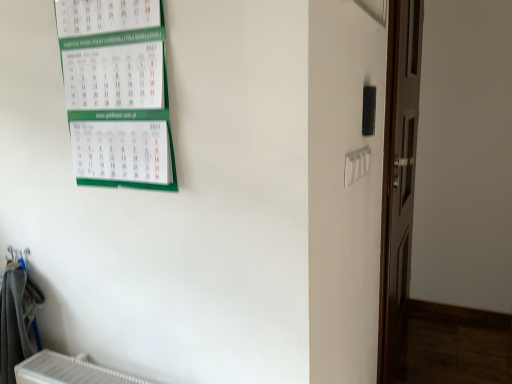
Question: Does green paper calendar at upper left have a greater height compared to brown wooden door at right?

Choices:
 (A) no
 (B) yes

Answer: (A)

Question: Considering the relative positions of green paper calendar at upper left and brown wooden door at right in the image provided, is green paper calendar at upper left in front of brown wooden door at right?

Choices:
 (A) no
 (B) yes

Answer: (B)

Question: From a real-world perspective, does green paper calendar at upper left sit lower than brown wooden door at right?

Choices:
 (A) yes
 (B) no

Answer: (B)

Question: Considering the relative sizes of green paper calendar at upper left and brown wooden door at right in the image provided, is green paper calendar at upper left wider than brown wooden door at right?

Choices:
 (A) yes
 (B) no

Answer: (B)

Question: Can you confirm if green paper calendar at upper left is smaller than brown wooden door at right?

Choices:
 (A) no
 (B) yes

Answer: (B)

Question: Is point (27, 274) positioned closer to the camera than point (137, 105)?

Choices:
 (A) closer
 (B) farther

Answer: (B)

Question: In terms of height, does gray fabric laundry at lower left look taller or shorter compared to green paper calendar at upper left?

Choices:
 (A) short
 (B) tall

Answer: (B)

Question: Is gray fabric laundry at lower left in front of or behind green paper calendar at upper left in the image?

Choices:
 (A) front
 (B) behind

Answer: (B)

Question: In terms of size, does gray fabric laundry at lower left appear bigger or smaller than green paper calendar at upper left?

Choices:
 (A) big
 (B) small

Answer: (A)

Question: From the image's perspective, is brown wooden door at right positioned above or below gray fabric laundry at lower left?

Choices:
 (A) above
 (B) below

Answer: (A)

Question: Considering the positions of point (390, 362) and point (16, 352), is point (390, 362) closer or farther from the camera than point (16, 352)?

Choices:
 (A) farther
 (B) closer

Answer: (A)

Question: Would you say brown wooden door at right is inside or outside gray fabric laundry at lower left?

Choices:
 (A) outside
 (B) inside

Answer: (A)

Question: Relative to gray fabric laundry at lower left, is brown wooden door at right in front or behind?

Choices:
 (A) behind
 (B) front

Answer: (A)

Question: From a real-world perspective, is brown wooden door at right physically located above or below green paper calendar at upper left?

Choices:
 (A) below
 (B) above

Answer: (A)

Question: Looking at the image, does brown wooden door at right seem bigger or smaller compared to green paper calendar at upper left?

Choices:
 (A) small
 (B) big

Answer: (B)